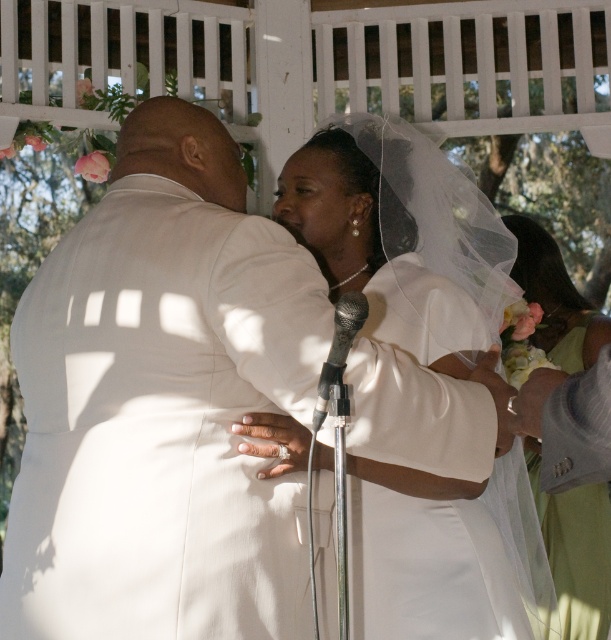
Is point (368, 616) more distant than point (535, 246)?

That is False.

Looking at this image, does white satin dress at center have a greater width compared to white satin veil at right?

Yes.

Who is more forward, (486, 301) or (591, 316)?

Point (486, 301)

This screenshot has height=640, width=611. Identify the location of white satin dress at center. (401, 236).

From the picture: Can you confirm if white satin dress at center is shorter than black metallic microphone at center?

Incorrect, white satin dress at center's height does not fall short of black metallic microphone at center's.

Which is more to the left, white satin dress at center or black metallic microphone at center?

Positioned to the left is black metallic microphone at center.

Is point (503, 490) positioned behind point (320, 401)?

That is True.

Locate an element on the screen. The image size is (611, 640). white satin dress at center is located at coordinates (401, 236).

Does white satin veil at right appear on the right side of black metallic microphone at center?

Indeed, white satin veil at right is positioned on the right side of black metallic microphone at center.

Which is behind, point (590, 522) or point (331, 384)?

The point (590, 522) is more distant.

Locate an element on the screen. white satin veil at right is located at coordinates (576, 550).